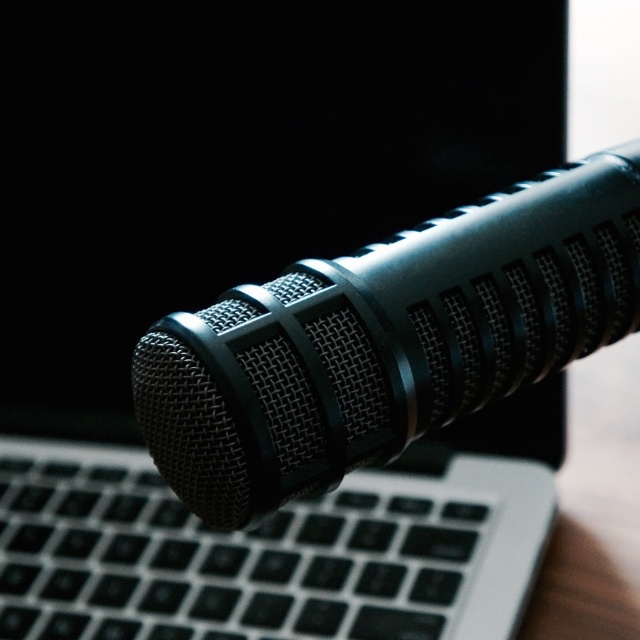
Question: Does black matte microphone at center have a smaller size compared to black matte keyboard at center?

Choices:
 (A) yes
 (B) no

Answer: (B)

Question: Is black matte microphone at center wider than black matte keyboard at center?

Choices:
 (A) yes
 (B) no

Answer: (B)

Question: Which of the following is the farthest from the observer?

Choices:
 (A) black matte microphone at center
 (B) black matte keyboard at center

Answer: (B)

Question: Which of the following is the closest to the observer?

Choices:
 (A) (145, 376)
 (B) (435, 512)

Answer: (A)

Question: Which point is farther from the camera taking this photo?

Choices:
 (A) click(532, 212)
 (B) click(134, 449)

Answer: (B)

Question: Does black matte microphone at center appear on the right side of black matte keyboard at center?

Choices:
 (A) no
 (B) yes

Answer: (B)